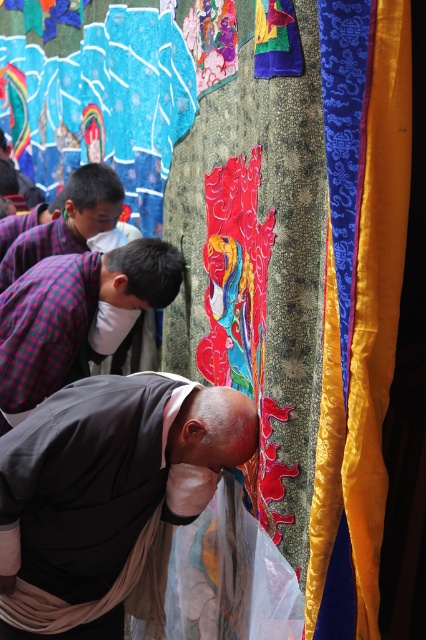
Question: Which point appears closest to the camera in this image?

Choices:
 (A) (97, 518)
 (B) (367, 628)
 (C) (6, 364)

Answer: (B)

Question: Which of the following is the closest to the observer?

Choices:
 (A) gray fabric monk at center
 (B) blue satin curtain at right
 (C) plaid fabric shirt at center

Answer: (B)

Question: Does gray fabric monk at center lie in front of plaid fabric shirt at center?

Choices:
 (A) yes
 (B) no

Answer: (A)

Question: Which point is closer to the camera?

Choices:
 (A) (161, 621)
 (B) (377, 611)

Answer: (B)

Question: Does gray fabric monk at center appear over plaid fabric shirt at center?

Choices:
 (A) yes
 (B) no

Answer: (B)

Question: Does gray fabric monk at center appear over plaid fabric shirt at center?

Choices:
 (A) yes
 (B) no

Answer: (B)